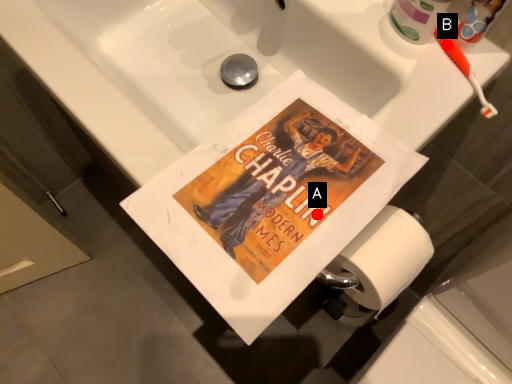
Question: Two points are circled on the image, labeled by A and B beside each circle. Which of the following is the farthest from the observer?

Choices:
 (A) A is further
 (B) B is further

Answer: (B)